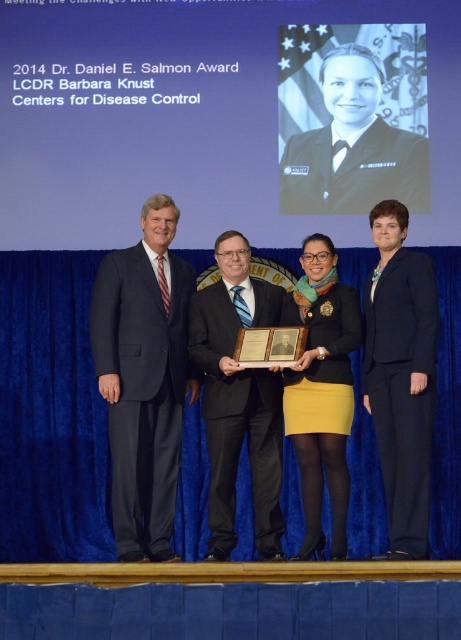
You are standing at the center of the stage and want to move towards the black suit at center. Which direction should you move to reach it?

Since you are already at the center of the stage, you are already at the position of the black suit at center.

You are a photographer at the event. You need to capture a photo where both the dark blue suit at left and the matte black blazer at center are visible. Since the camera frame can only focus on one subject at a time, which subject should you focus on to ensure both are in the shot?

You should focus on the matte black blazer at center because the dark blue suit at left is to the left of it, so both will be in the frame when centered on the blazer.